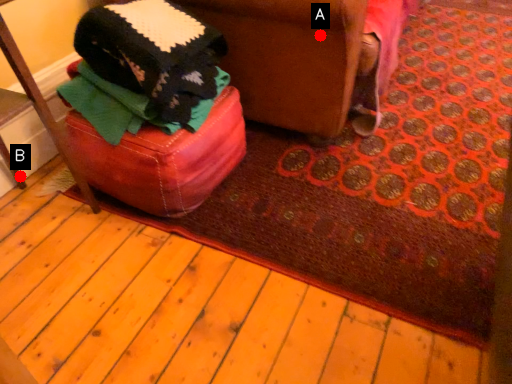
Question: Two points are circled on the image, labeled by A and B beside each circle. Which point is farther to the camera?

Choices:
 (A) A is further
 (B) B is further

Answer: (B)